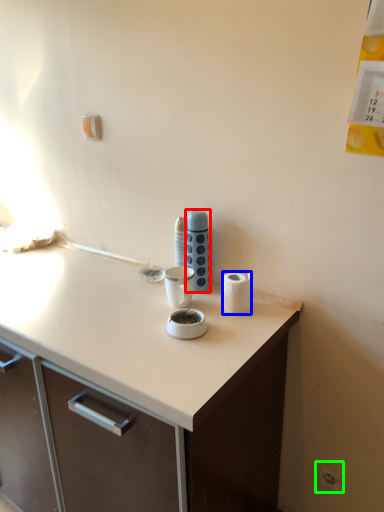
Question: Which object is the farthest from appliance (highlighted by a red box)? Choose among these: paper towel (highlighted by a blue box) or electric outlet (highlighted by a green box).

Choices:
 (A) paper towel
 (B) electric outlet

Answer: (B)